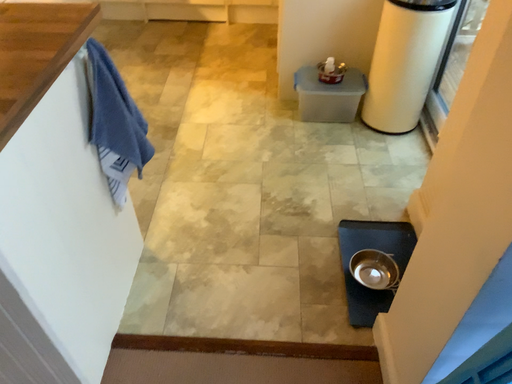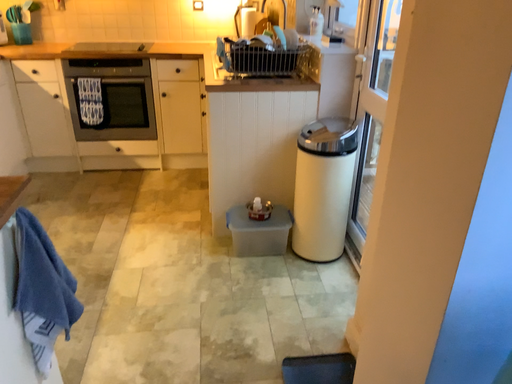
Question: Which way did the camera rotate in the video?

Choices:
 (A) rotated left
 (B) rotated right

Answer: (B)